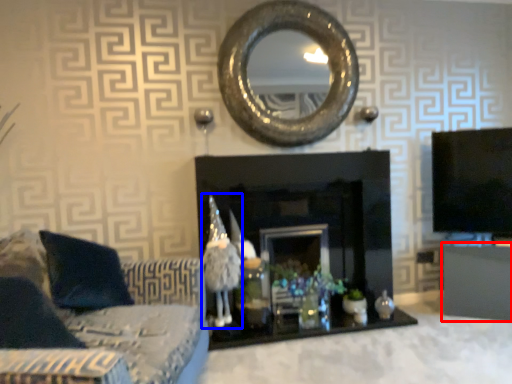
Question: Which object is closer to the camera taking this photo, furniture (highlighted by a red box) or toy (highlighted by a blue box)?

Choices:
 (A) furniture
 (B) toy

Answer: (B)